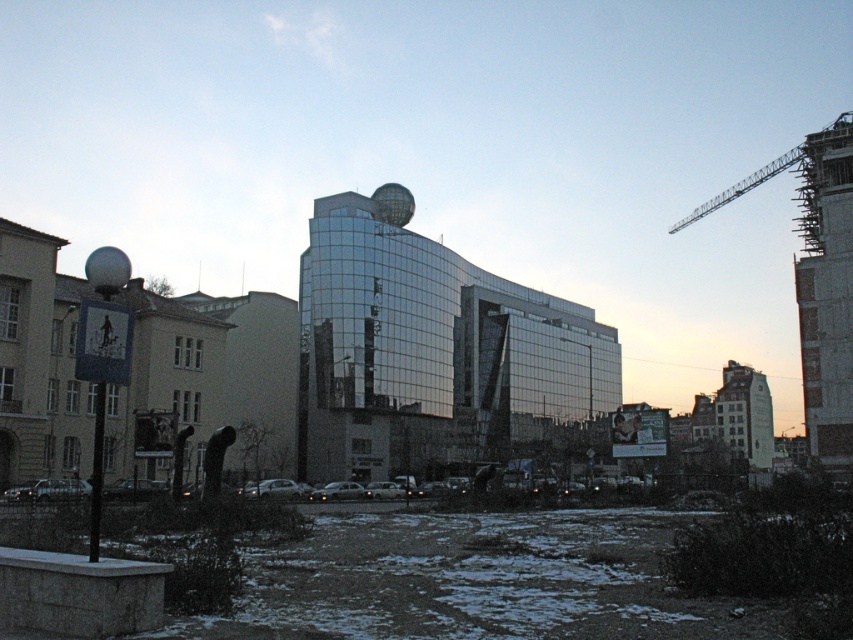
You are an architect analyzing the urban layout. Given the scene described, which object, the glossy glass building at center or the metallic gray crane at upper right, would you estimate to be physically smaller in real life?

The glossy glass building at center is smaller in size compared to the metallic gray crane at upper right.

You are standing at the origin of the coordinate system in the image. You want to walk towards the point at (323, 384). However, there is an obstacle at point (784, 161). Will you encounter the obstacle before reaching your destination?

Yes, you will encounter the obstacle at point (784, 161) before reaching the point at (323, 384) because the point at (784, 161) is in front of the destination point according to the spatial description.

You are a city planner reviewing this urban layout. The glossy glass building at center and the metallic gray crane at upper right are both in your field of view. Which structure has a narrower width?

The glossy glass building at center is thinner than the metallic gray crane at upper right, so the glossy glass building at center has a narrower width.